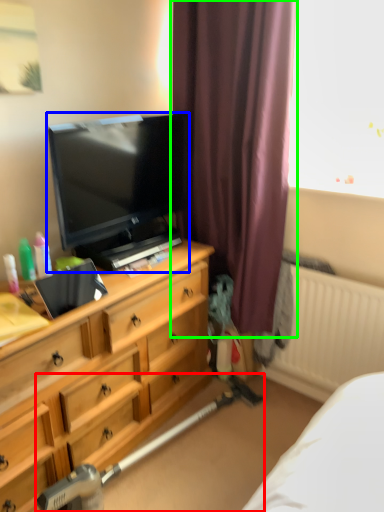
Question: Estimate the real-world distances between objects in this image. Which object is farther from equipment (highlighted by a red box), television (highlighted by a blue box) or curtain (highlighted by a green box)?

Choices:
 (A) television
 (B) curtain

Answer: (B)